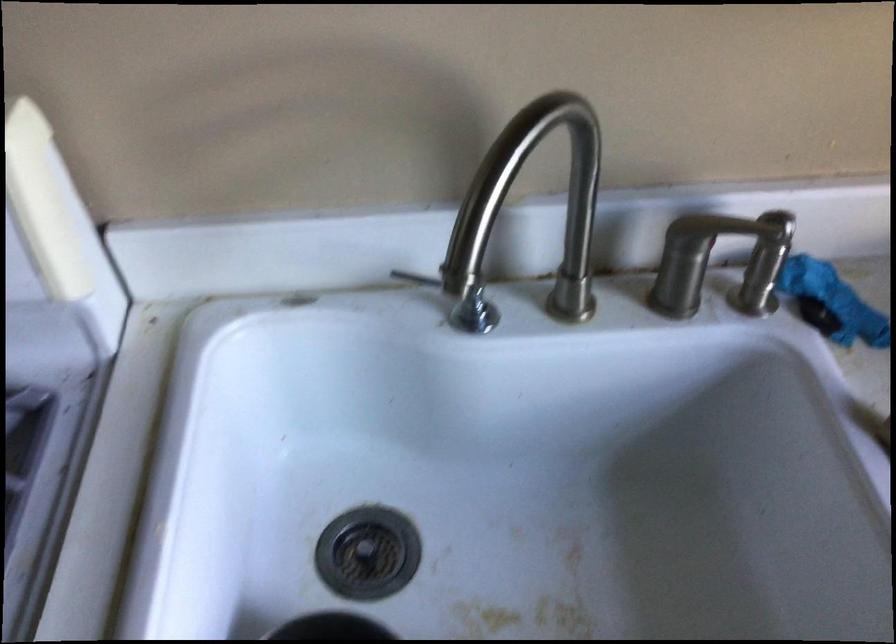
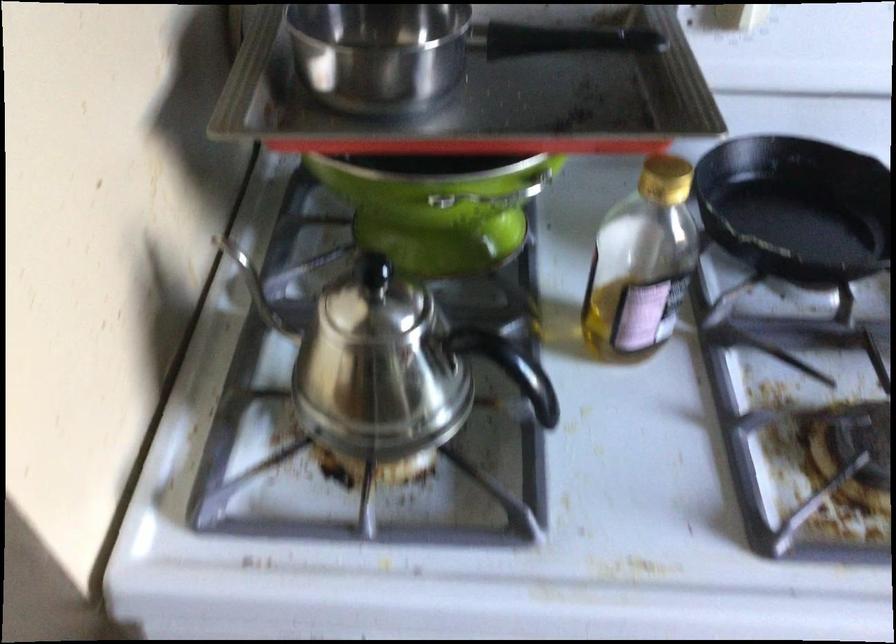
Question: The images are taken continuously from a first-person perspective. In which direction are you moving?

Choices:
 (A) Left
 (B) Right
 (C) Forward
 (D) Backward

Answer: (A)